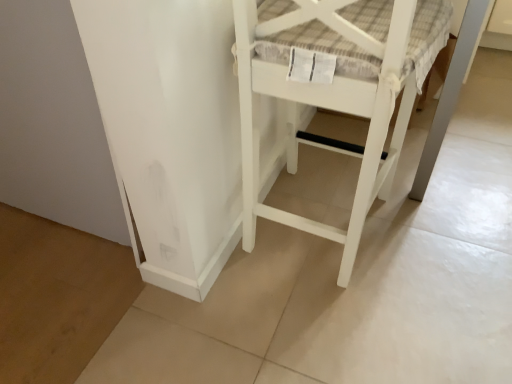
Measure the distance between white wood chair at center and camera.

white wood chair at center is 27.64 inches away from camera.

The image size is (512, 384). What are the coordinates of `white wood chair at center` in the screenshot? It's located at (332, 92).

Describe the element at coordinates (332, 92) in the screenshot. I see `white wood chair at center` at that location.

At what (x,y) coordinates should I click in order to perform the action: click on white wood chair at center. Please return your answer as a coordinate pair (x, y). This screenshot has height=384, width=512. Looking at the image, I should click on (332, 92).